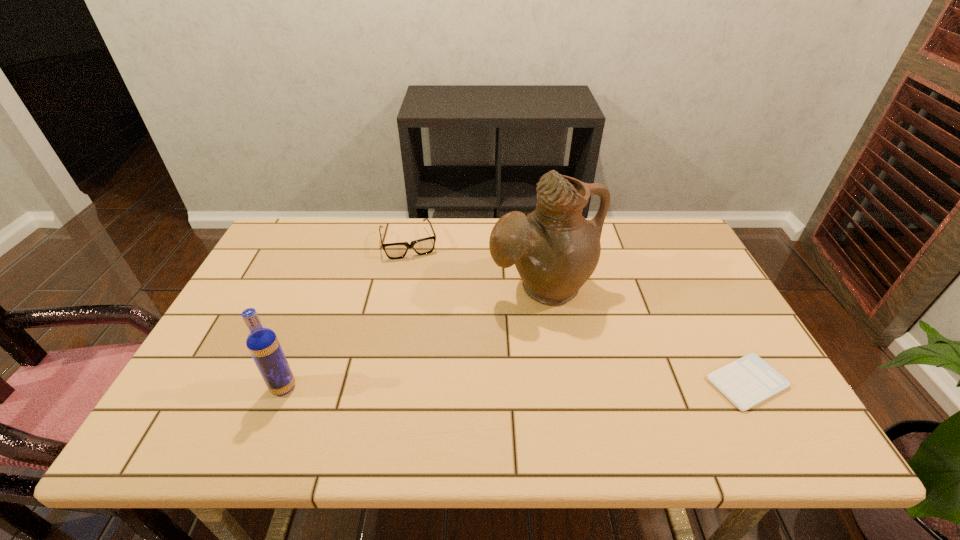
What are the coordinates of `free point that satisfies the following two spatial constraints: 1. on the front side of the third tallest object; 2. on the right side of the rightmost object` in the screenshot? It's located at (381, 382).

Locate an element on the screen. This screenshot has width=960, height=540. free space in the image that satisfies the following two spatial constraints: 1. on the back side of the third shortest object; 2. on the left side of the third object from right to left is located at coordinates (341, 242).

Find the location of a particular element. The width and height of the screenshot is (960, 540). free location that satisfies the following two spatial constraints: 1. on the back side of the vodka; 2. on the left side of the calculator is located at coordinates (285, 382).